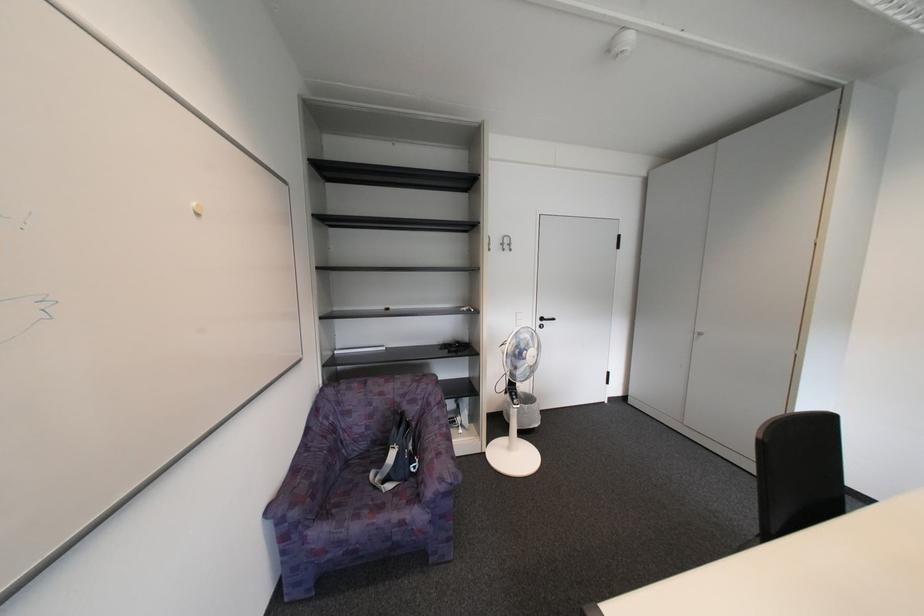
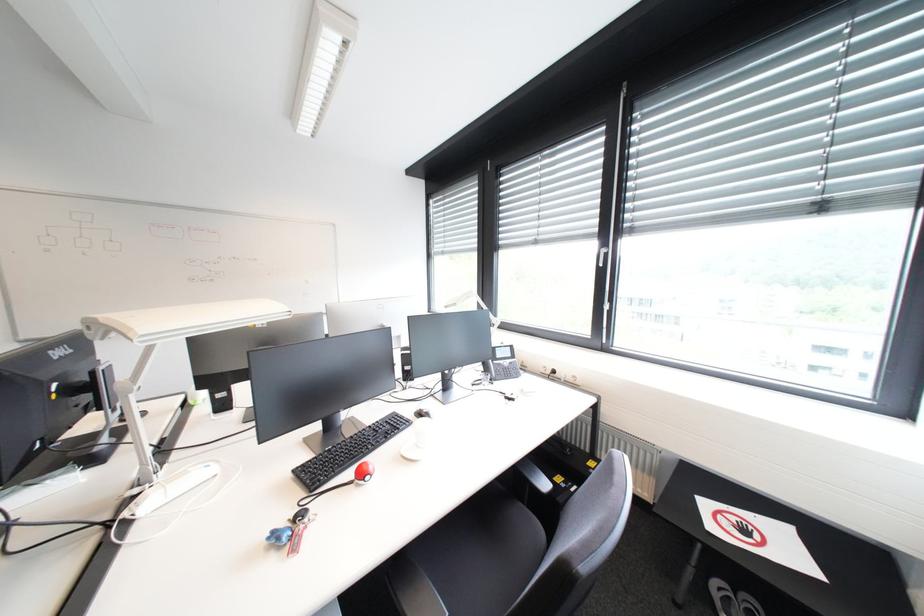
Question: The first image is from the beginning of the video and the second image is from the end. How did the camera likely rotate when shooting the video?

Choices:
 (A) Left
 (B) Right
 (C) Up
 (D) Down

Answer: (B)